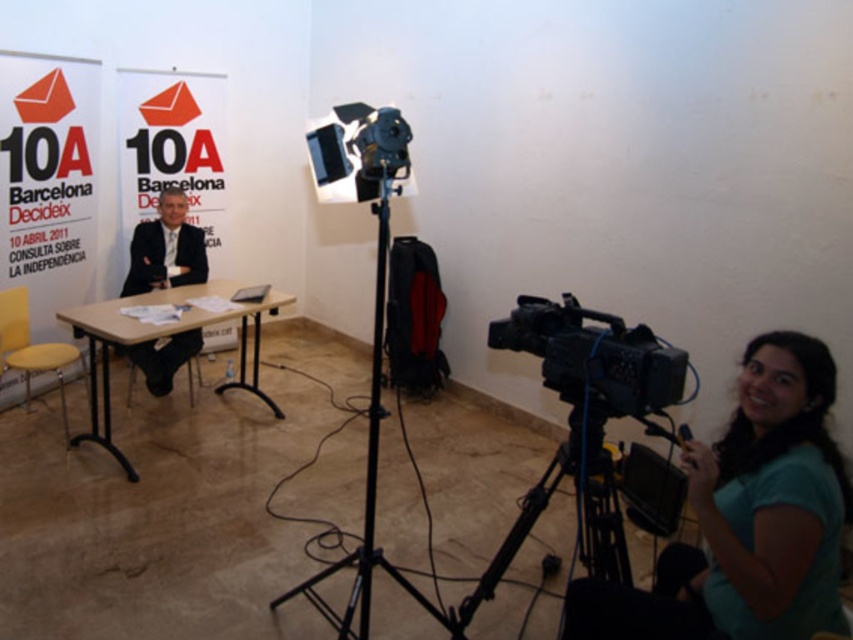
You are a photographer setting up for a photo shoot in this press room. You need to ensure that the teal matte shirt at lower right and the matte black suit at center are both visible in the frame. Given their sizes, which object should you prioritize framing closer to avoid cropping?

The teal matte shirt at lower right should be prioritized closer in the frame since it is smaller in width compared to the matte black suit at center, ensuring it remains fully visible without cropping.

You are a photographer setting up for a press conference. You need to ensure that the teal matte shirt at lower right and the matte black suit at center are both visible in the frame. Given their sizes, which object will appear larger in the photo?

The teal matte shirt at lower right is much taller than the matte black suit at center, so it will appear larger in the photo.